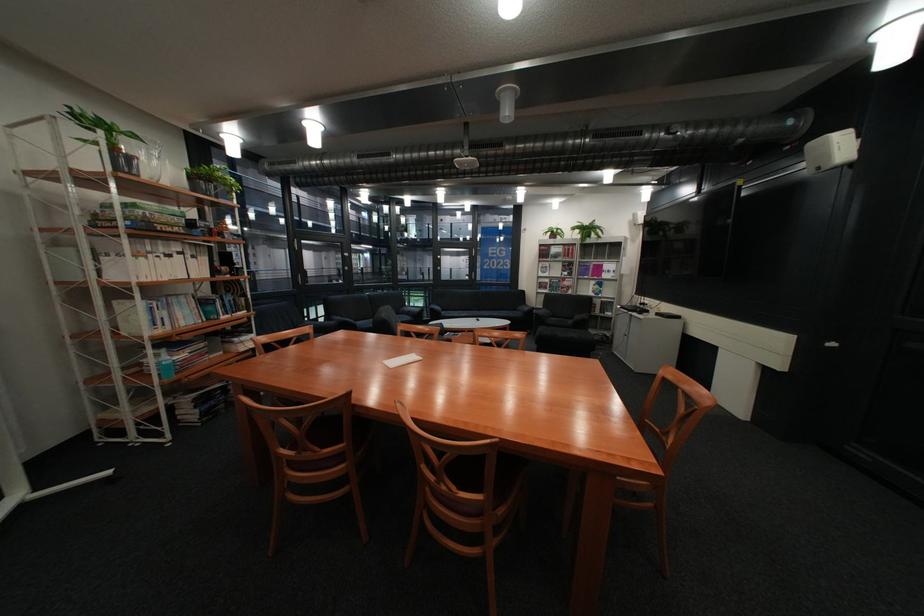
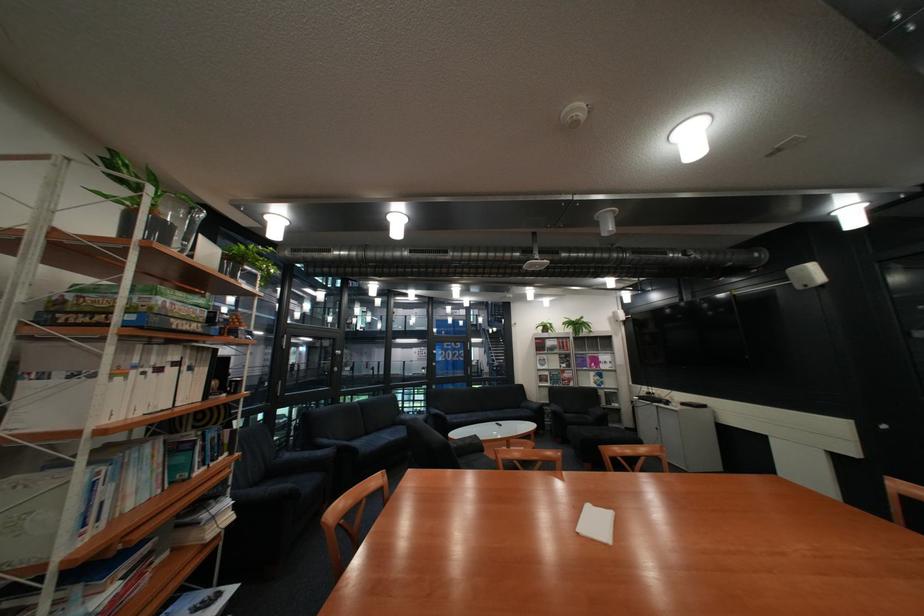
Locate, in the second image, the point that corresponds to (x=531, y=310) in the first image.

(535, 408)